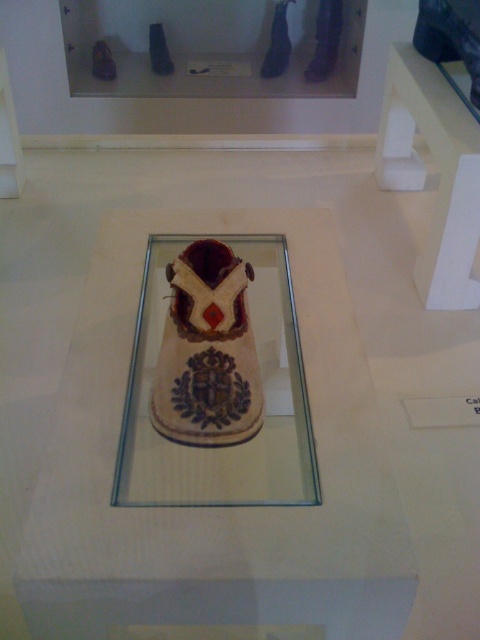
Question: Can you confirm if transparent glass at center is positioned above white matte table at upper right?

Choices:
 (A) no
 (B) yes

Answer: (A)

Question: Can you confirm if transparent glass at center is positioned above white matte table at upper right?

Choices:
 (A) yes
 (B) no

Answer: (B)

Question: Which point is farther to the camera?

Choices:
 (A) white matte table at upper right
 (B) transparent glass at center

Answer: (A)

Question: Which object appears closest to the camera in this image?

Choices:
 (A) transparent glass at center
 (B) white matte table at upper right

Answer: (A)

Question: Among these objects, which one is farthest from the camera?

Choices:
 (A) white matte table at upper right
 (B) transparent glass at center

Answer: (A)

Question: In this image, where is transparent glass at center located relative to white matte table at upper right?

Choices:
 (A) left
 (B) right

Answer: (A)